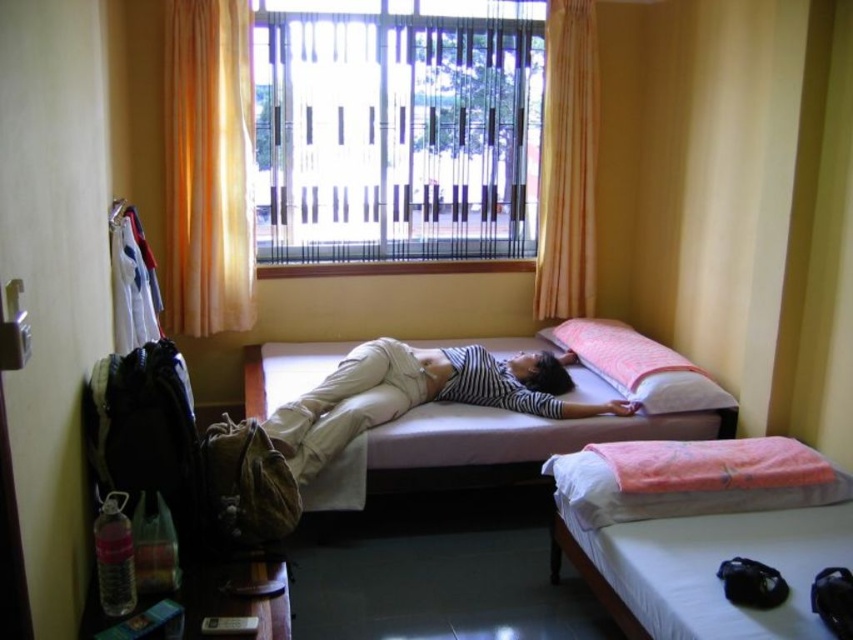
Is mattress at center positioned before orange fabric curtain at upper center?

Yes, mattress at center is in front of orange fabric curtain at upper center.

Can you confirm if mattress at center is shorter than orange fabric curtain at upper center?

Yes, mattress at center is shorter than orange fabric curtain at upper center.

Is point (469, 420) positioned after point (164, 81)?

No, (469, 420) is closer to viewer.

I want to click on mattress at center, so click(479, 433).

Can you confirm if white cotton bed at lower right is taller than orange fabric pillow at lower right?

Yes, white cotton bed at lower right is taller than orange fabric pillow at lower right.

Who is higher up, white cotton bed at lower right or orange fabric pillow at lower right?

orange fabric pillow at lower right is above.

Where is `white cotton bed at lower right`? white cotton bed at lower right is located at coordinates (703, 547).

The image size is (853, 640). Identify the location of white cotton bed at lower right. (703, 547).

I want to click on white cotton bed at lower right, so click(x=703, y=547).

Does point (851, 541) come in front of point (584, 304)?

Yes, it is.

Which is behind, point (817, 634) or point (552, 28)?

Point (552, 28)

Where is `white cotton bed at lower right`? Image resolution: width=853 pixels, height=640 pixels. white cotton bed at lower right is located at coordinates (703, 547).